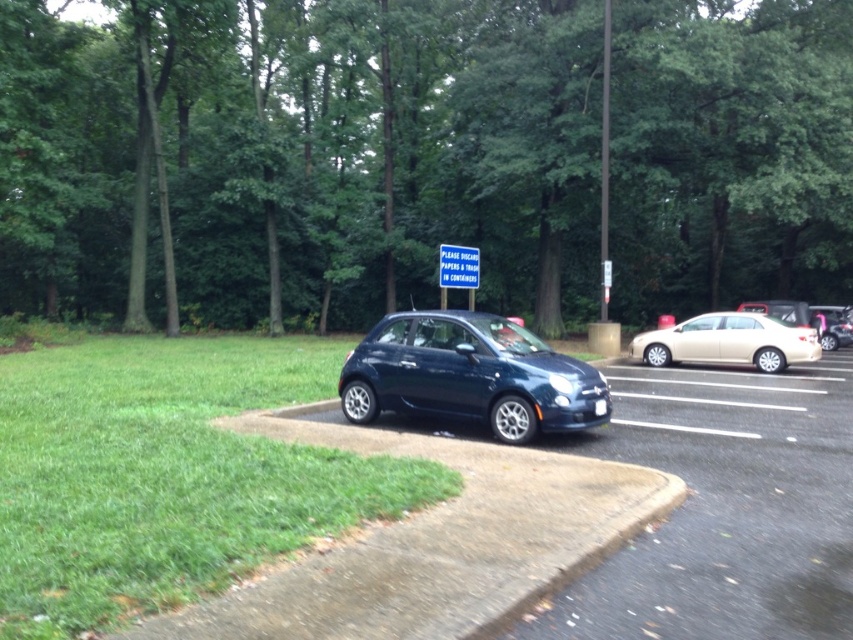
Question: Which is nearer to the satin gold sedan at right?

Choices:
 (A) glossy dark blue hatchback at center
 (B) blue plastic sign at center

Answer: (B)

Question: Can you confirm if green leafy tree at upper center is positioned to the left of satin gold sedan at right?

Choices:
 (A) yes
 (B) no

Answer: (A)

Question: Does glossy dark blue hatchback at center appear over satin gold sedan at right?

Choices:
 (A) yes
 (B) no

Answer: (B)

Question: Which of the following is the farthest from the observer?

Choices:
 (A) click(776, 355)
 (B) click(312, 84)
 (C) click(469, 269)
 (D) click(563, 417)

Answer: (B)

Question: Does satin gold sedan at right appear on the right side of blue plastic sign at center?

Choices:
 (A) yes
 (B) no

Answer: (A)

Question: Which point is farther to the camera?

Choices:
 (A) blue plastic sign at center
 (B) satin gold sedan at right

Answer: (A)